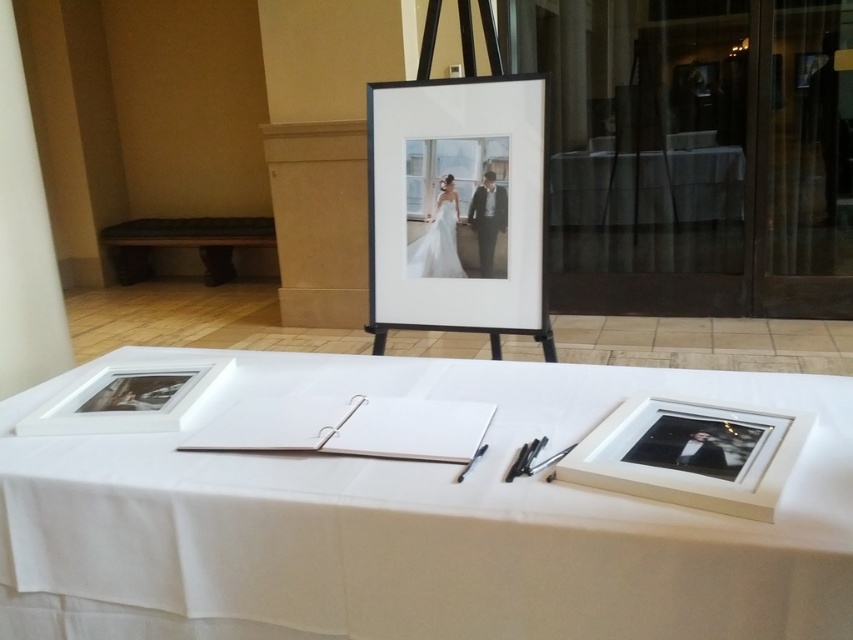
Between white paper at center and white cloth at center, which one appears on the right side from the viewer's perspective?

white cloth at center is more to the right.

Is white paper at center thinner than white cloth at center?

No.

Where is `white paper at center`? The width and height of the screenshot is (853, 640). white paper at center is located at coordinates (415, 520).

At what (x,y) coordinates should I click in order to perform the action: click on white paper at center. Please return your answer as a coordinate pair (x, y). Looking at the image, I should click on (415, 520).

Is white paper at center smaller than green fabric bench at left?

Actually, white paper at center might be larger than green fabric bench at left.

Between white paper at center and green fabric bench at left, which one appears on the right side from the viewer's perspective?

Positioned to the right is white paper at center.

Is point (625, 372) behind point (142, 259)?

No, (625, 372) is closer to viewer.

Where is `white paper at center`? The image size is (853, 640). white paper at center is located at coordinates (415, 520).

Is black glossy photo frame at lower right in front of white satin dress at center?

Yes.

Between point (637, 419) and point (454, 220), which one is positioned in front?

Point (637, 419) is in front.

Who is more distant from viewer, (567,481) or (422,243)?

Positioned behind is point (422,243).

The width and height of the screenshot is (853, 640). In order to click on black glossy photo frame at lower right in this screenshot , I will do coord(689,454).